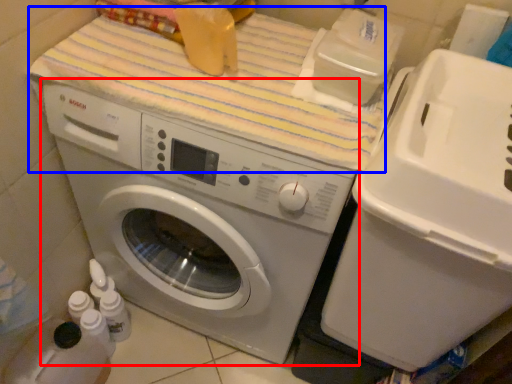
Question: Which of the following is the farthest to the observer, washing machine (highlighted by a red box) or bath towel (highlighted by a blue box)?

Choices:
 (A) washing machine
 (B) bath towel

Answer: (B)